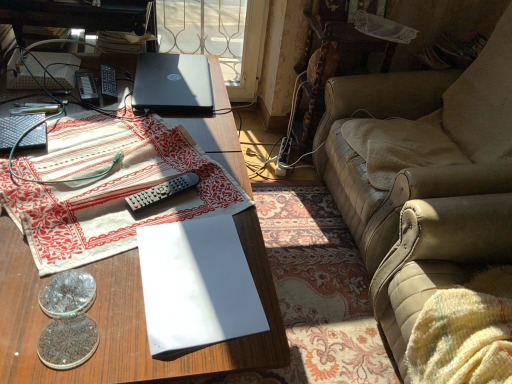
Find the location of a particular element. The width and height of the screenshot is (512, 384). vacant space that is in between gray plastic remote at center, which ranks as the first remote control in right-to-left order, and black plastic remote control at center, acting as the 2th remote control starting from the right is located at coordinates (133, 139).